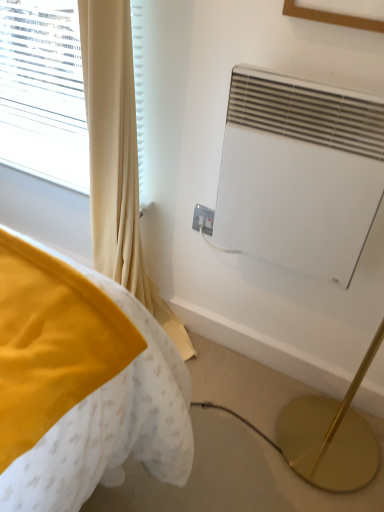
Question: Is white matte air conditioner at upper right closer to camera compared to wooden picture frame at upper center?

Choices:
 (A) no
 (B) yes

Answer: (A)

Question: Is white matte air conditioner at upper right oriented towards wooden picture frame at upper center?

Choices:
 (A) no
 (B) yes

Answer: (A)

Question: Can you confirm if white matte air conditioner at upper right is taller than wooden picture frame at upper center?

Choices:
 (A) yes
 (B) no

Answer: (A)

Question: Can you confirm if white matte air conditioner at upper right is positioned to the left of wooden picture frame at upper center?

Choices:
 (A) yes
 (B) no

Answer: (A)

Question: Is white matte air conditioner at upper right at the right side of wooden picture frame at upper center?

Choices:
 (A) yes
 (B) no

Answer: (B)

Question: Considering the positions of wooden picture frame at upper center and white plastic electric outlet at center in the image, is wooden picture frame at upper center taller or shorter than white plastic electric outlet at center?

Choices:
 (A) short
 (B) tall

Answer: (B)

Question: From a real-world perspective, is wooden picture frame at upper center positioned above or below white plastic electric outlet at center?

Choices:
 (A) below
 (B) above

Answer: (B)

Question: Considering the positions of wooden picture frame at upper center and white plastic electric outlet at center in the image, is wooden picture frame at upper center wider or thinner than white plastic electric outlet at center?

Choices:
 (A) wide
 (B) thin

Answer: (A)

Question: From the image's perspective, is wooden picture frame at upper center located above or below white plastic electric outlet at center?

Choices:
 (A) below
 (B) above

Answer: (B)

Question: Looking at the image, does white matte air conditioner at upper right seem bigger or smaller compared to wooden picture frame at upper center?

Choices:
 (A) big
 (B) small

Answer: (A)

Question: Does point (306, 101) appear closer or farther from the camera than point (372, 30)?

Choices:
 (A) closer
 (B) farther

Answer: (B)

Question: Is white matte air conditioner at upper right spatially inside wooden picture frame at upper center, or outside of it?

Choices:
 (A) inside
 (B) outside

Answer: (B)

Question: From the image's perspective, is white matte air conditioner at upper right above or below wooden picture frame at upper center?

Choices:
 (A) above
 (B) below

Answer: (B)

Question: Is beige fabric curtain at left taller or shorter than white matte air conditioner at upper right?

Choices:
 (A) tall
 (B) short

Answer: (A)

Question: Is point (130, 153) positioned closer to the camera than point (216, 209)?

Choices:
 (A) farther
 (B) closer

Answer: (B)